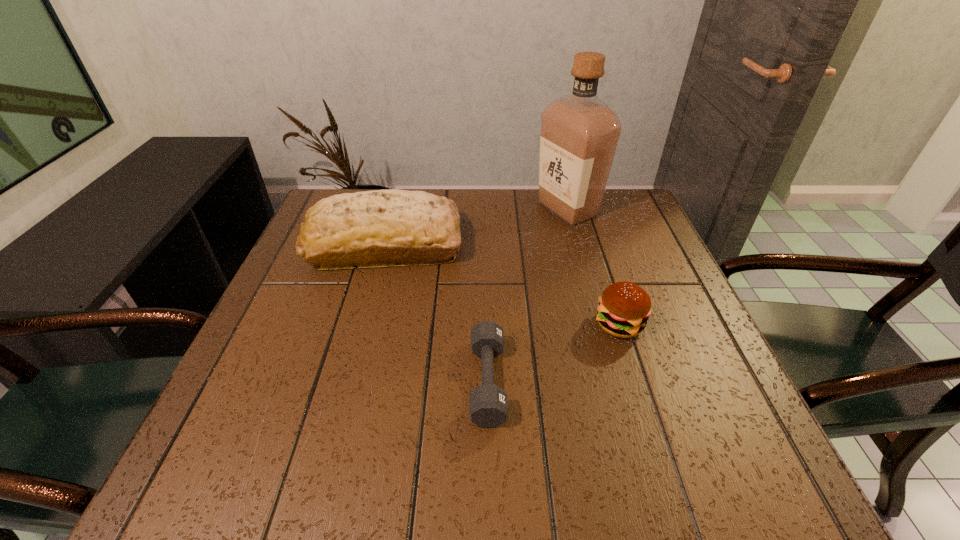
The width and height of the screenshot is (960, 540). What are the coordinates of `free space at the near edge of the desktop` in the screenshot? It's located at (394, 460).

You are a GUI agent. You are given a task and a screenshot of the screen. Output one action in this format:
    pyautogui.click(x=<x>, y=<y>)
    Task: Click on the vacant region at the left edge of the desktop
    
    Given the screenshot: What is the action you would take?
    pyautogui.click(x=276, y=297)

Identify the location of vacant region at the right edge. The width and height of the screenshot is (960, 540). (660, 307).

Locate an element on the screen. This screenshot has height=540, width=960. blank space at the near left corner of the desktop is located at coordinates (251, 472).

In the image, there is a desktop. Where is `blank space at the far right corner`? This screenshot has width=960, height=540. blank space at the far right corner is located at coordinates pyautogui.click(x=620, y=221).

This screenshot has height=540, width=960. What are the coordinates of `empty space between the shortest object and the second tallest object` in the screenshot? It's located at (437, 313).

Locate an element on the screen. The image size is (960, 540). free spot between the dumbbell and the liquor is located at coordinates pyautogui.click(x=528, y=295).

Where is `free space that is in between the shortest object and the hamburger`? free space that is in between the shortest object and the hamburger is located at coordinates (554, 353).

The height and width of the screenshot is (540, 960). I want to click on free space that is in between the shortest object and the bread, so click(437, 313).

Image resolution: width=960 pixels, height=540 pixels. I want to click on free area in between the tallest object and the shortest object, so click(x=528, y=295).